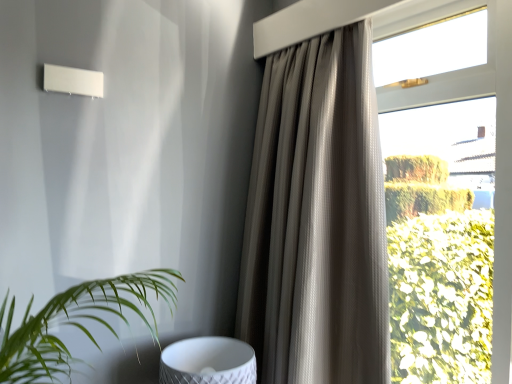
Question: Does textured taupe curtain at upper right have a lesser height compared to white textured swivel chair at lower center?

Choices:
 (A) no
 (B) yes

Answer: (A)

Question: From a real-world perspective, is textured taupe curtain at upper right positioned under white textured swivel chair at lower center based on gravity?

Choices:
 (A) yes
 (B) no

Answer: (B)

Question: Is textured taupe curtain at upper right in contact with white textured swivel chair at lower center?

Choices:
 (A) yes
 (B) no

Answer: (B)

Question: From the image's perspective, is textured taupe curtain at upper right located above white textured swivel chair at lower center?

Choices:
 (A) yes
 (B) no

Answer: (A)

Question: Does textured taupe curtain at upper right contain white textured swivel chair at lower center?

Choices:
 (A) no
 (B) yes

Answer: (A)

Question: Does textured taupe curtain at upper right appear on the left side of white textured swivel chair at lower center?

Choices:
 (A) no
 (B) yes

Answer: (A)

Question: From the image's perspective, is white textured swivel chair at lower center on top of textured taupe curtain at upper right?

Choices:
 (A) no
 (B) yes

Answer: (A)

Question: From a real-world perspective, is white textured swivel chair at lower center physically below textured taupe curtain at upper right?

Choices:
 (A) no
 (B) yes

Answer: (B)

Question: Considering the relative sizes of white textured swivel chair at lower center and textured taupe curtain at upper right in the image provided, is white textured swivel chair at lower center shorter than textured taupe curtain at upper right?

Choices:
 (A) yes
 (B) no

Answer: (A)

Question: Does white textured swivel chair at lower center have a smaller size compared to textured taupe curtain at upper right?

Choices:
 (A) yes
 (B) no

Answer: (A)

Question: Can you confirm if white textured swivel chair at lower center is positioned to the right of textured taupe curtain at upper right?

Choices:
 (A) no
 (B) yes

Answer: (A)

Question: Can you confirm if white textured swivel chair at lower center is positioned to the left of textured taupe curtain at upper right?

Choices:
 (A) no
 (B) yes

Answer: (B)

Question: Do you think textured taupe curtain at upper right is within white textured swivel chair at lower center, or outside of it?

Choices:
 (A) outside
 (B) inside

Answer: (A)